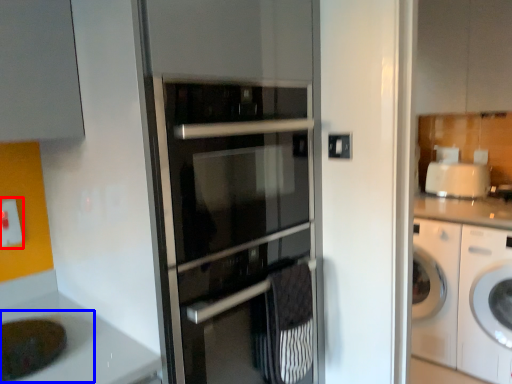
Question: Which point is closer to the camera, electric outlet (highlighted by a red box) or sink (highlighted by a blue box)?

Choices:
 (A) electric outlet
 (B) sink

Answer: (B)